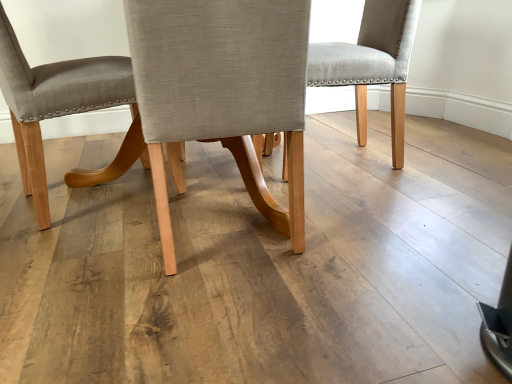
Identify the location of vacant space in matte gray fabric chair at center, placed as the third chair when sorted from right to left (from a real-world perspective). (x=109, y=190).